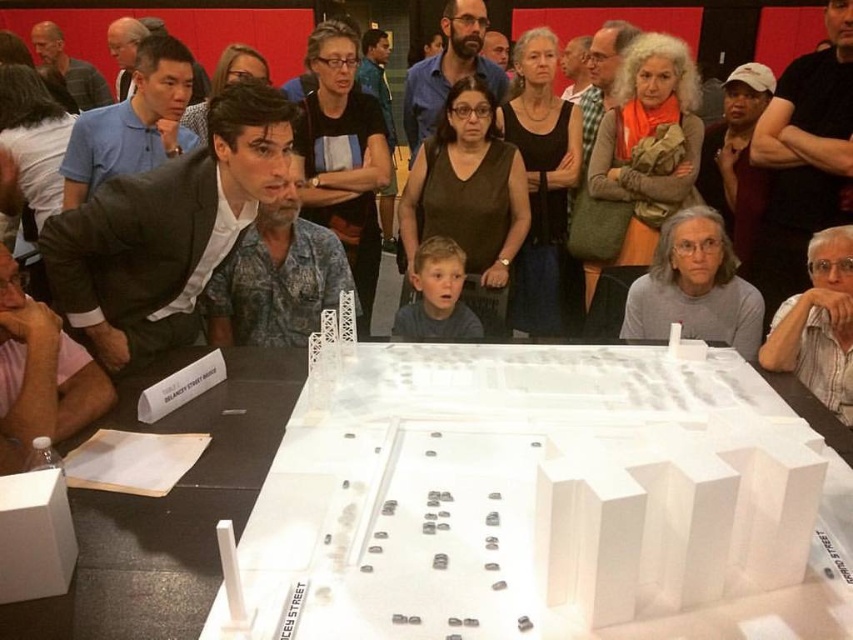
Question: Which object is farther from the camera taking this photo?

Choices:
 (A) matte black suit at center
 (B) blonde hair boy at center
 (C) white plastic table at center

Answer: (A)

Question: Does gray matte shirt at lower right have a greater width compared to blonde hair boy at center?

Choices:
 (A) no
 (B) yes

Answer: (B)

Question: Does matte black suit at center appear on the left side of gray matte shirt at lower right?

Choices:
 (A) yes
 (B) no

Answer: (B)

Question: Which of the following is the farthest from the observer?

Choices:
 (A) (672, 214)
 (B) (471, 314)
 (C) (107, 554)

Answer: (A)

Question: Which object is farther from the camera taking this photo?

Choices:
 (A) matte black suit at center
 (B) blonde hair boy at center
 (C) white plastic table at center

Answer: (A)

Question: Can you confirm if white plastic table at center is positioned above blonde hair boy at center?

Choices:
 (A) no
 (B) yes

Answer: (A)